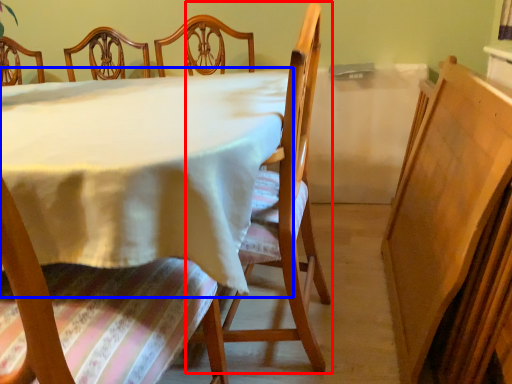
Question: Which point is closer to the camera, chair (highlighted by a red box) or table (highlighted by a blue box)?

Choices:
 (A) chair
 (B) table

Answer: (B)